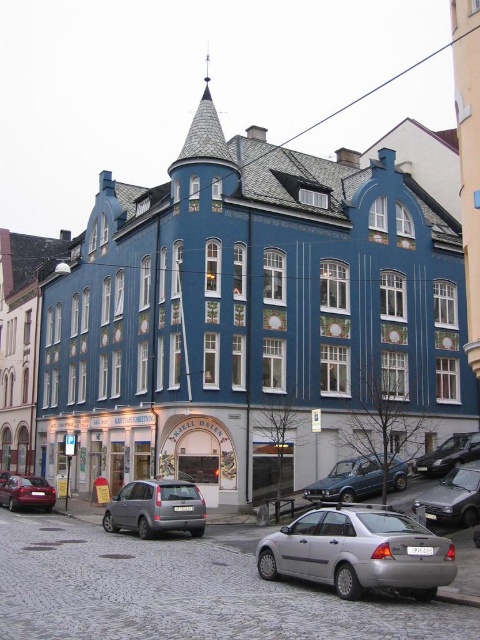
Question: Which point appears closest to the camera in this image?

Choices:
 (A) (365, 484)
 (B) (447, 492)
 (C) (364, 428)
 (D) (164, 496)

Answer: (D)

Question: Does matte blue building at left have a greater width compared to shiny black sedan at lower right?

Choices:
 (A) no
 (B) yes

Answer: (B)

Question: From the image, what is the correct spatial relationship of matte gray suv at center in relation to blue metallic sedan at center?

Choices:
 (A) left
 (B) right

Answer: (A)

Question: Which point appears farthest from the camera in this image?

Choices:
 (A) (427, 499)
 (B) (21, 285)
 (C) (343, 468)
 (D) (357, 593)

Answer: (B)

Question: Is silver metallic sedan at lower right bigger than shiny red sedan at lower left?

Choices:
 (A) yes
 (B) no

Answer: (A)

Question: Considering the real-world distances, which object is closest to the matte blue building at left?

Choices:
 (A) blue painted building at center
 (B) satin silver sedan at lower center

Answer: (A)